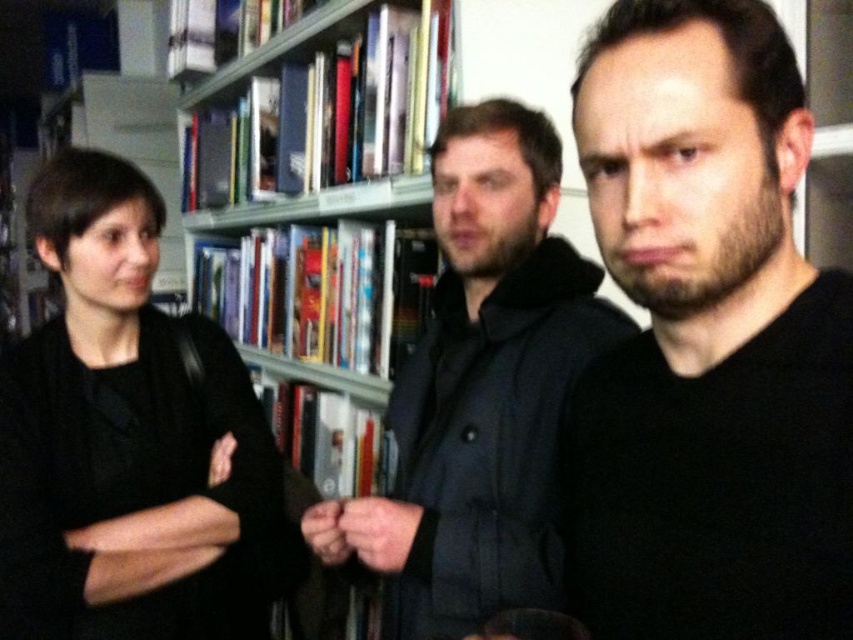
Between black matte shirt at center and black matte jacket at left, which one is positioned higher?

black matte shirt at center is higher up.

Does black matte shirt at center have a greater height compared to black matte jacket at left?

No, black matte shirt at center is not taller than black matte jacket at left.

Does point (599, 609) come behind point (247, 618)?

No, (599, 609) is closer to viewer.

At what (x,y) coordinates should I click in order to perform the action: click on black matte shirt at center. Please return your answer as a coordinate pair (x, y). Looking at the image, I should click on (708, 340).

Locate an element on the screen. The width and height of the screenshot is (853, 640). black matte shirt at center is located at coordinates (708, 340).

Does point (838, 333) lie behind point (216, 115)?

That is False.

Where is `black matte shirt at center`? The height and width of the screenshot is (640, 853). black matte shirt at center is located at coordinates (708, 340).

Between matte black coat at center and metallic gray bookshelf at upper center, which one has less height?

With less height is matte black coat at center.

Who is taller, matte black coat at center or metallic gray bookshelf at upper center?

metallic gray bookshelf at upper center

What do you see at coordinates (480, 390) in the screenshot?
I see `matte black coat at center` at bounding box center [480, 390].

The image size is (853, 640). Find the location of `matte black coat at center`. matte black coat at center is located at coordinates (480, 390).